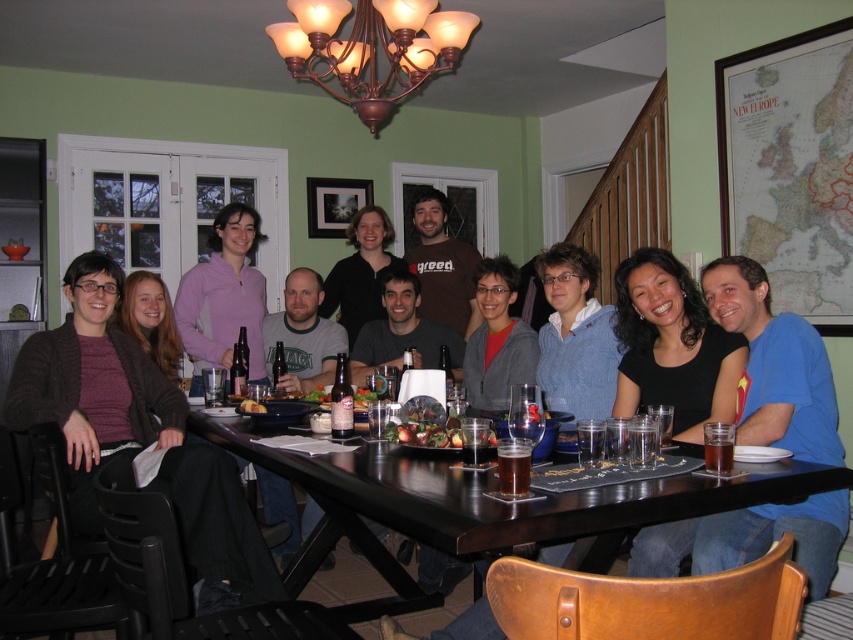
Question: Where is bronze/metallic chandelier at upper center located in relation to fresh tomato salad at center in the image?

Choices:
 (A) below
 (B) above

Answer: (B)

Question: Among these objects, which one is farthest from the camera?

Choices:
 (A) translucent glass beer at table center
 (B) golden brown bread at table center
 (C) bronze/metallic chandelier at upper center

Answer: (B)

Question: Is black wood table at center below golden brown bread at table center?

Choices:
 (A) no
 (B) yes

Answer: (B)

Question: Among these objects, which one is nearest to the camera?

Choices:
 (A) golden brown bread at table center
 (B) bronze/metallic chandelier at upper center

Answer: (B)

Question: Which object is farther from the camera taking this photo?

Choices:
 (A) golden brown bread at table center
 (B) black wood table at center
 (C) brown glass bottle at center
 (D) bronze/metallic chandelier at upper center

Answer: (A)

Question: Does brown glass bottle at center appear on the left side of golden brown bread at table center?

Choices:
 (A) yes
 (B) no

Answer: (B)